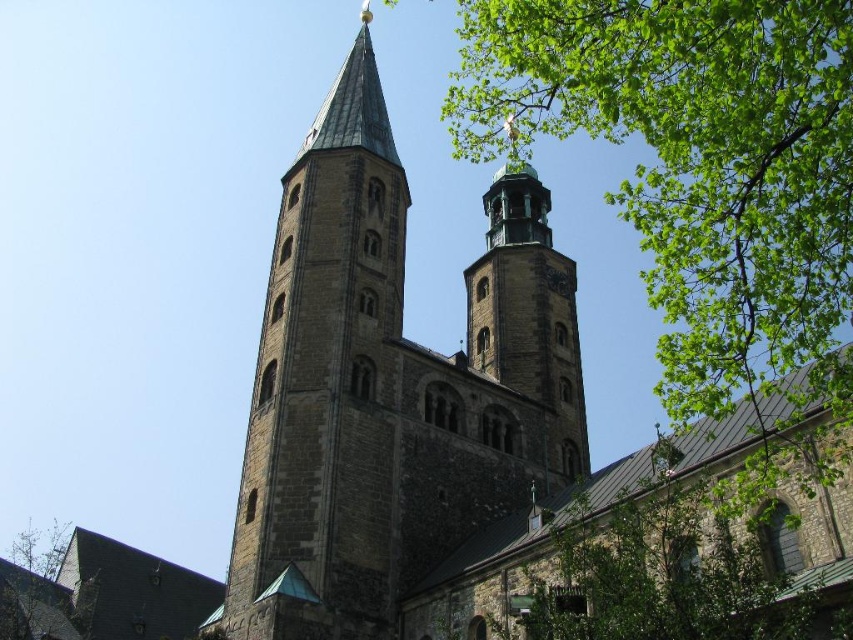
Can you confirm if green leafy tree at upper right is positioned above stone bell tower at center?

Yes.

Is point (703, 339) behind point (573, 403)?

No, (703, 339) is in front of (573, 403).

Locate an element on the screen. green leafy tree at upper right is located at coordinates (695, 168).

Between green leafy tree at upper right and dark gray stone tower at center, which one appears on the left side from the viewer's perspective?

dark gray stone tower at center

Is green leafy tree at upper right to the left of dark gray stone tower at center from the viewer's perspective?

No, green leafy tree at upper right is not to the left of dark gray stone tower at center.

Is point (680, 413) farther from camera compared to point (399, 538)?

No, it is in front of (399, 538).

Locate an element on the screen. Image resolution: width=853 pixels, height=640 pixels. green leafy tree at upper right is located at coordinates (695, 168).

Is green leafy tree at upper right smaller than green leafy tree at lower right?

No.

Which is in front, point (816, 330) or point (637, 563)?

Point (637, 563) is in front.

The width and height of the screenshot is (853, 640). I want to click on green leafy tree at upper right, so click(695, 168).